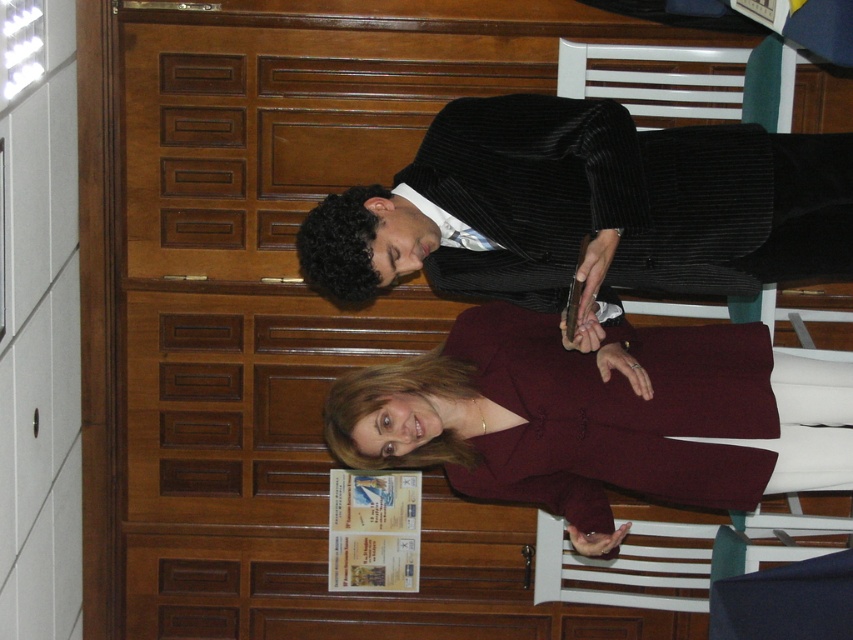
You are attending a formal event and need to sit down. There is a burgundy fabric coat at center and a white plastic chair at center in the image. Which object should you avoid sitting on to maintain proper etiquette?

You should avoid sitting on the burgundy fabric coat at center because it is located above the white plastic chair at center, indicating it might be draped over the chair and not meant for sitting.

You are an event planner trying to arrange a photo shoot. You need to place a decorative banner exactly where the black corduroy suit at center is currently standing. What coordinates should you use for the banner placement?

The banner should be placed at coordinates point (590, 205) since that is where the black corduroy suit at center is located.

You are attending a formal event and need to determine if the burgundy fabric coat at center can be placed on the white plastic chair at center without touching the ceiling. The ceiling height is 2.5 meters. Can you confirm if this is possible?

The burgundy fabric coat at center is taller than the white plastic chair at center. However, the exact height of the coat and chair isn t provided. Without knowing their specific dimensions, it s impossible to determine if placing the coat on the chair would touch the ceiling.